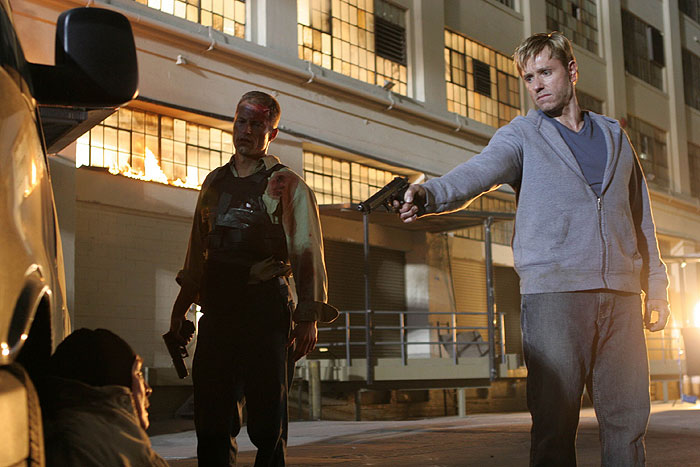
The height and width of the screenshot is (467, 700). What are the coordinates of `vent` in the screenshot? It's located at (396, 38), (482, 75).